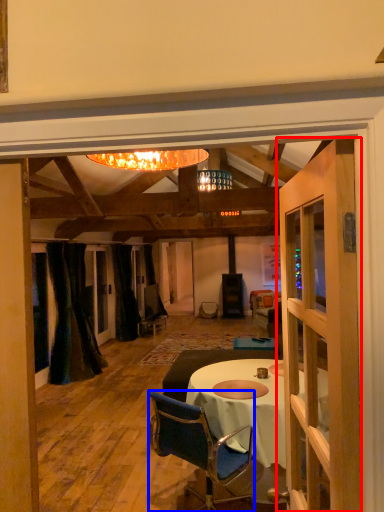
Question: Which point is further to the camera, door (highlighted by a red box) or chair (highlighted by a blue box)?

Choices:
 (A) door
 (B) chair

Answer: (B)